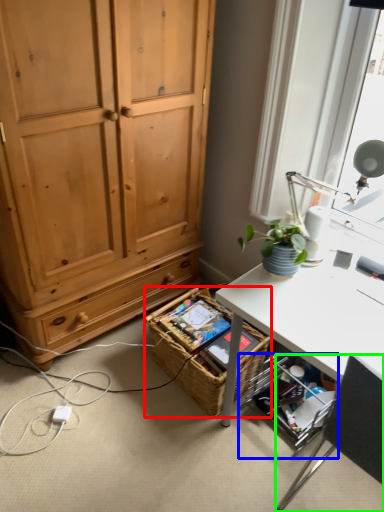
Question: Based on their relative distances, which object is nearer to picnic basket (highlighted by a red box)? Choose from shelf (highlighted by a blue box) and chair (highlighted by a green box).

Choices:
 (A) shelf
 (B) chair

Answer: (A)